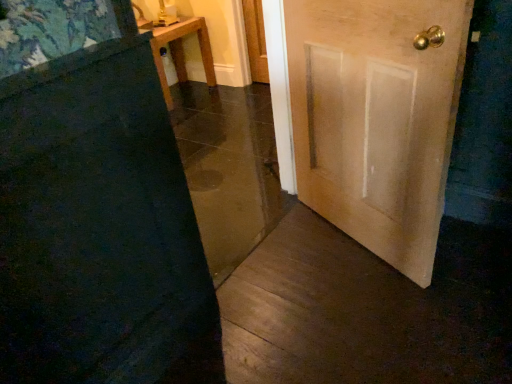
Where is `wooden door at center, marked as the 2th door in a right-to-left arrangement`? The image size is (512, 384). wooden door at center, marked as the 2th door in a right-to-left arrangement is located at coordinates (99, 227).

Image resolution: width=512 pixels, height=384 pixels. Describe the element at coordinates (99, 227) in the screenshot. I see `wooden door at center, marked as the 2th door in a right-to-left arrangement` at that location.

Image resolution: width=512 pixels, height=384 pixels. I want to click on wooden table at upper left, so click(180, 50).

The image size is (512, 384). Describe the element at coordinates (180, 50) in the screenshot. I see `wooden table at upper left` at that location.

The image size is (512, 384). What are the coordinates of `wooden door at center, the 1th door in the left-to-right sequence` in the screenshot? It's located at (99, 227).

From the image's perspective, between wooden table at upper left and wooden door at center, the 1th door in the left-to-right sequence, who is located below?

wooden door at center, the 1th door in the left-to-right sequence, from the image's perspective.

Is wooden table at upper left positioned beyond the bounds of wooden door at center, marked as the 2th door in a right-to-left arrangement?

wooden table at upper left lies outside wooden door at center, marked as the 2th door in a right-to-left arrangement,'s area.

Looking at this image, is wooden table at upper left placed right next to wooden door at center, the 1th door in the left-to-right sequence?

They are not placed beside each other.

Locate an element on the screen. furniture above the wooden door at center, marked as the 2th door in a right-to-left arrangement (from the image's perspective) is located at coordinates (180, 50).

Where is `furniture beneath the light brown wooden door at right, which is the 1th door in right-to-left order (from a real-world perspective)`? Image resolution: width=512 pixels, height=384 pixels. furniture beneath the light brown wooden door at right, which is the 1th door in right-to-left order (from a real-world perspective) is located at coordinates (180, 50).

Is wooden table at upper left not close to light brown wooden door at right, which is the 1th door in right-to-left order?

Yes, wooden table at upper left is far from light brown wooden door at right, which is the 1th door in right-to-left order.

Considering the positions of objects wooden table at upper left and light brown wooden door at right, which is the 1th door in right-to-left order, in the image provided, who is more to the right, wooden table at upper left or light brown wooden door at right, which is the 1th door in right-to-left order,?

From the viewer's perspective, light brown wooden door at right, which is the 1th door in right-to-left order, appears more on the right side.

From the image's perspective, is wooden door at center, the 1th door in the left-to-right sequence, beneath wooden table at upper left?

Correct, wooden door at center, the 1th door in the left-to-right sequence, appears lower than wooden table at upper left in the image.

Visually, is wooden door at center, the 1th door in the left-to-right sequence, positioned to the left or to the right of wooden table at upper left?

From the image, it's evident that wooden door at center, the 1th door in the left-to-right sequence, is to the right of wooden table at upper left.

Considering the relative sizes of wooden door at center, marked as the 2th door in a right-to-left arrangement, and wooden table at upper left in the image provided, is wooden door at center, marked as the 2th door in a right-to-left arrangement, wider than wooden table at upper left?

Incorrect, the width of wooden door at center, marked as the 2th door in a right-to-left arrangement, does not surpass that of wooden table at upper left.

Does point (26, 237) come closer to viewer compared to point (212, 62)?

Yes, it is in front of point (212, 62).

Considering the relative sizes of light brown wooden door at right, the second door viewed from the left, and wooden door at center, marked as the 2th door in a right-to-left arrangement, in the image provided, is light brown wooden door at right, the second door viewed from the left, taller than wooden door at center, marked as the 2th door in a right-to-left arrangement,?

In fact, light brown wooden door at right, the second door viewed from the left, may be shorter than wooden door at center, marked as the 2th door in a right-to-left arrangement.

Which is more to the right, light brown wooden door at right, which is the 1th door in right-to-left order, or wooden door at center, the 1th door in the left-to-right sequence?

Positioned to the right is light brown wooden door at right, which is the 1th door in right-to-left order.

Could you tell me if light brown wooden door at right, which is the 1th door in right-to-left order, is facing wooden door at center, the 1th door in the left-to-right sequence?

Yes.

Where is `door located on the left of light brown wooden door at right, the second door viewed from the left`? This screenshot has height=384, width=512. door located on the left of light brown wooden door at right, the second door viewed from the left is located at coordinates (99, 227).

Does wooden door at center, the 1th door in the left-to-right sequence, touch light brown wooden door at right, the second door viewed from the left?

No, wooden door at center, the 1th door in the left-to-right sequence, is not touching light brown wooden door at right, the second door viewed from the left.

Between wooden door at center, marked as the 2th door in a right-to-left arrangement, and light brown wooden door at right, which is the 1th door in right-to-left order, which one has smaller size?

wooden door at center, marked as the 2th door in a right-to-left arrangement.

Visually, is wooden door at center, marked as the 2th door in a right-to-left arrangement, positioned to the left or to the right of light brown wooden door at right, the second door viewed from the left?

Clearly, wooden door at center, marked as the 2th door in a right-to-left arrangement, is on the left of light brown wooden door at right, the second door viewed from the left, in the image.

Between light brown wooden door at right, the second door viewed from the left, and wooden table at upper left, which one is positioned in front?

light brown wooden door at right, the second door viewed from the left, is closer to the camera.

Is light brown wooden door at right, the second door viewed from the left, placed right next to wooden table at upper left?

No, light brown wooden door at right, the second door viewed from the left, is not touching wooden table at upper left.

Is light brown wooden door at right, the second door viewed from the left, turned away from wooden table at upper left?

No, light brown wooden door at right, the second door viewed from the left, is not facing the opposite direction of wooden table at upper left.

Locate an element on the screen. The image size is (512, 384). furniture that is on the left side of light brown wooden door at right, which is the 1th door in right-to-left order is located at coordinates (180, 50).

You are a GUI agent. You are given a task and a screenshot of the screen. Output one action in this format:
    pyautogui.click(x=<x>, y=<y>)
    Task: Click on the furniture that appears behind the wooden door at center, the 1th door in the left-to-right sequence
    Image resolution: width=512 pixels, height=384 pixels.
    Given the screenshot: What is the action you would take?
    pyautogui.click(x=180, y=50)

Where is `the 1st door in front of the wooden table at upper left, starting your count from the anchor`? Image resolution: width=512 pixels, height=384 pixels. the 1st door in front of the wooden table at upper left, starting your count from the anchor is located at coordinates (377, 117).

Which object lies further to the anchor point light brown wooden door at right, which is the 1th door in right-to-left order, wooden table at upper left or wooden door at center, the 1th door in the left-to-right sequence?

Based on the image, wooden table at upper left appears to be further to light brown wooden door at right, which is the 1th door in right-to-left order.

Looking at the image, which one is located further to wooden door at center, the 1th door in the left-to-right sequence, wooden table at upper left or light brown wooden door at right, the second door viewed from the left?

Based on the image, wooden table at upper left appears to be further to wooden door at center, the 1th door in the left-to-right sequence.

Looking at this image, looking at the image, which one is located closer to wooden table at upper left, light brown wooden door at right, the second door viewed from the left, or wooden door at center, marked as the 2th door in a right-to-left arrangement?

light brown wooden door at right, the second door viewed from the left, is positioned closer to the anchor wooden table at upper left.

Based on their spatial positions, is light brown wooden door at right, which is the 1th door in right-to-left order, or wooden table at upper left closer to wooden door at center, the 1th door in the left-to-right sequence?

The object closer to wooden door at center, the 1th door in the left-to-right sequence, is light brown wooden door at right, which is the 1th door in right-to-left order.

Based on their spatial positions, is wooden door at center, the 1th door in the left-to-right sequence, or wooden table at upper left closer to light brown wooden door at right, the second door viewed from the left?

wooden door at center, the 1th door in the left-to-right sequence.

Looking at the image, which one is located closer to wooden table at upper left, wooden door at center, marked as the 2th door in a right-to-left arrangement, or light brown wooden door at right, which is the 1th door in right-to-left order?

Among the two, light brown wooden door at right, which is the 1th door in right-to-left order, is located nearer to wooden table at upper left.

The width and height of the screenshot is (512, 384). I want to click on door between wooden door at center, marked as the 2th door in a right-to-left arrangement, and wooden table at upper left, along the z-axis, so click(x=377, y=117).